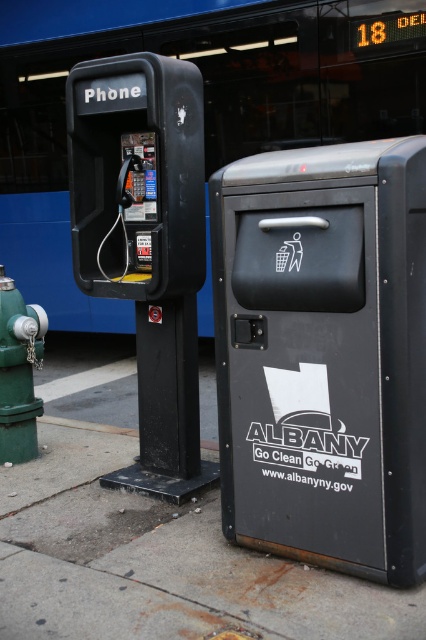
You are a delivery person carrying a large package that requires you to walk through a narrow alley. The alley is only 2 meters wide. You see the matte black mailbox at center and the green matte hydrant at lower left. Can you pass through the alley without hitting either object?

The distance between the matte black mailbox at center and the green matte hydrant at lower left is 2.10 meters. Since the alley is only 2 meters wide, you cannot pass through without hitting one of the objects because the space between them is slightly wider than the alley.

You are standing on the concrete sidewalk at lower center and want to use the matte black phone at left. Which direction should you move to reach the phone?

The concrete sidewalk at lower center is positioned on the right side of the matte black phone at left, so you should move to the left to reach the phone.

You are a delivery person who needs to place a package near the matte black mailbox at center and the green matte hydrant at lower left. Which object should you place it closer to if you want it to be on the right side of the scene?

The matte black mailbox at center is to the right of the green matte hydrant at lower left, so placing the package near the matte black mailbox at center would position it closer to the right side of the scene.